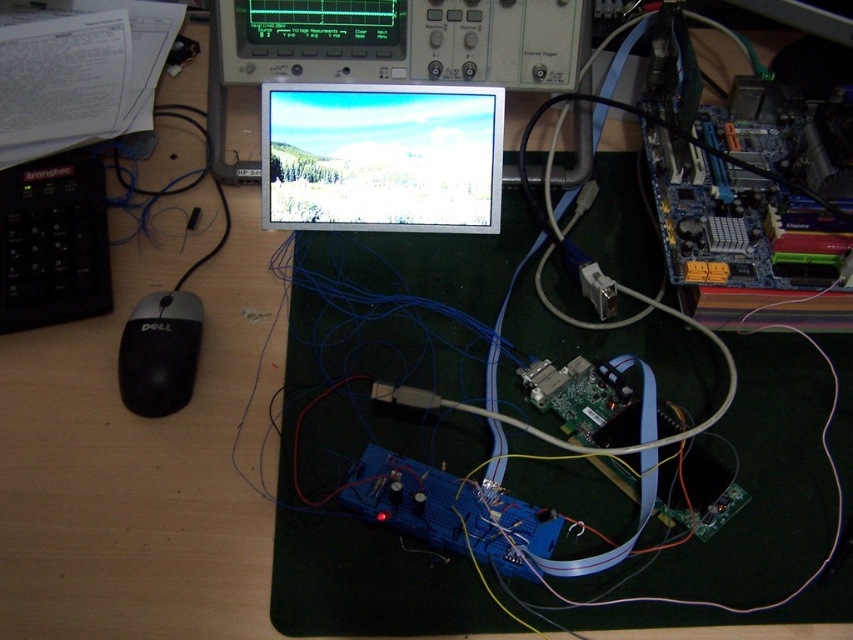
Does matte black screen at center have a larger size compared to black matte mouse at lower left?

Incorrect, matte black screen at center is not larger than black matte mouse at lower left.

Locate an element on the screen. This screenshot has height=640, width=853. matte black screen at center is located at coordinates (381, 157).

What are the coordinates of `matte black screen at center` in the screenshot? It's located at (381, 157).